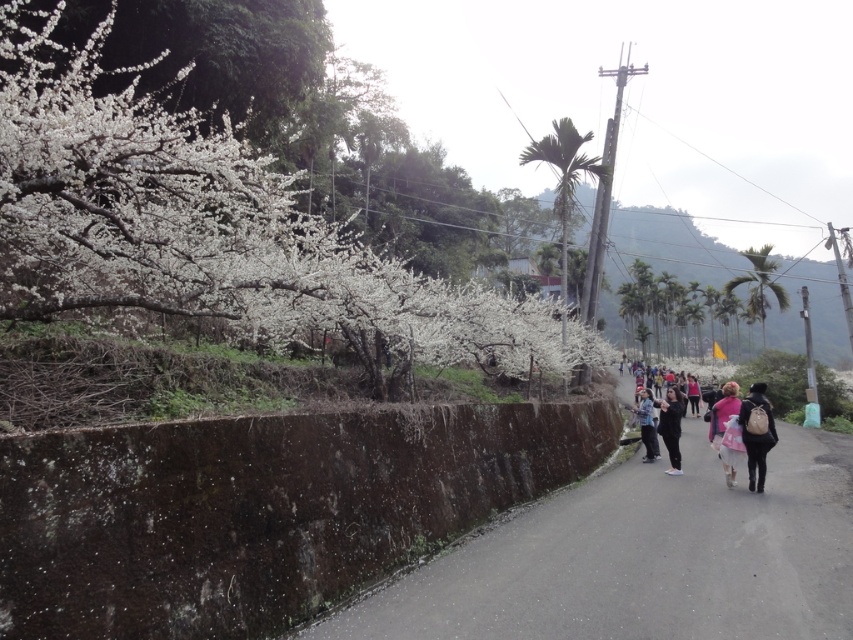
You are standing at the center of the road in the image. Looking towards the right side, can you see the green leafy palm tree at right? Please explain your reasoning based on the scene description.

Yes, the green leafy palm tree at right is located at point [759,285], which is on the right side of the road. Since you are standing at the center, looking towards the right, the palm tree should be visible in that direction based on the scene description.

You are a pedestrian standing on the dark brown asphalt road at center. You want to walk towards the green leafy palm at center. Which direction should you move to get closer to the palm?

The dark brown asphalt road at center is closer to the viewer than the green leafy palm at center, so you should move forward along the road to get closer to the palm.